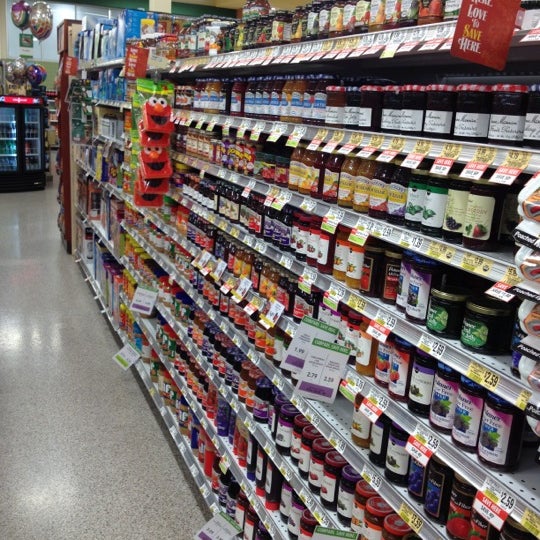
What are the coordinates of `glass jar` in the screenshot? It's located at (450, 312).